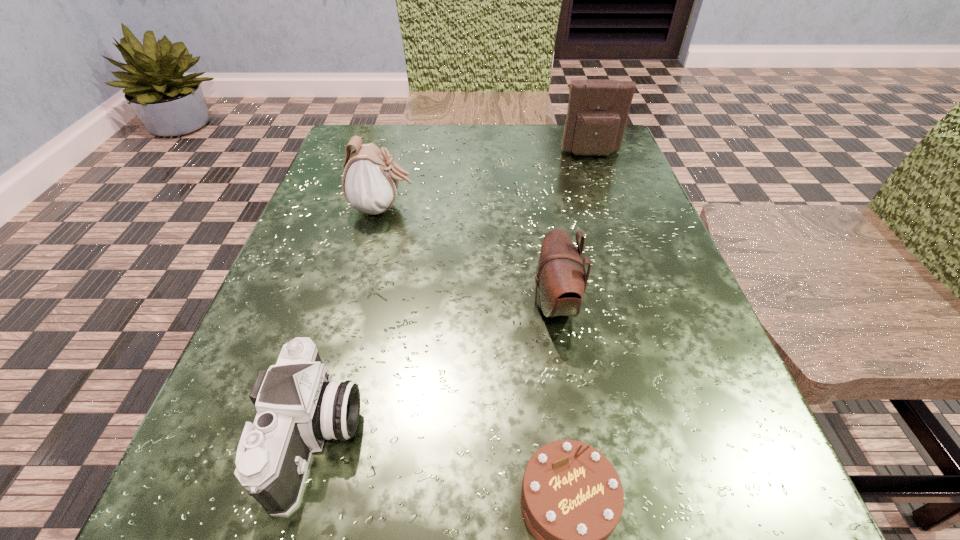
This screenshot has height=540, width=960. What are the coordinates of `vacant space located with the flap open on the nearest pouch` in the screenshot? It's located at (336, 303).

Find the location of a particular element. The width and height of the screenshot is (960, 540). free location located with the flap open on the nearest pouch is located at coordinates coord(316,303).

Image resolution: width=960 pixels, height=540 pixels. In order to click on vacant space situated 0.320m on the back of the camera in this screenshot , I will do `click(375, 221)`.

The width and height of the screenshot is (960, 540). Find the location of `object that is at the far edge`. object that is at the far edge is located at coordinates [597, 114].

Find the location of a particular element. The image size is (960, 540). object situated at the near edge is located at coordinates (298, 406).

Where is `pouch present at the left edge`? The height and width of the screenshot is (540, 960). pouch present at the left edge is located at coordinates (370, 181).

I want to click on camera positioned at the left edge, so click(298, 406).

At what (x,y) coordinates should I click in order to perform the action: click on object that is at the right edge. Please return your answer as a coordinate pair (x, y). The height and width of the screenshot is (540, 960). Looking at the image, I should click on (597, 114).

Locate an element on the screen. The image size is (960, 540). object at the near left corner is located at coordinates (298, 406).

Find the location of a particular element. object at the far right corner is located at coordinates (597, 114).